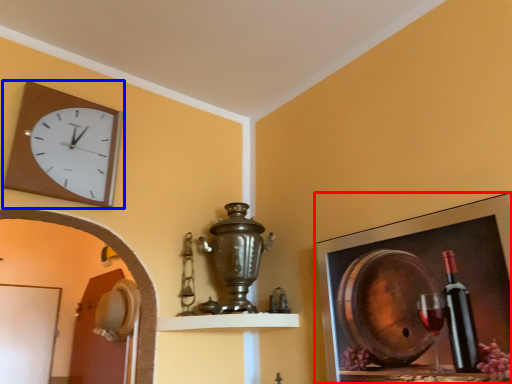
Question: Which of the following is the farthest to the observer, picture frame (highlighted by a red box) or wall clock (highlighted by a blue box)?

Choices:
 (A) picture frame
 (B) wall clock

Answer: (B)